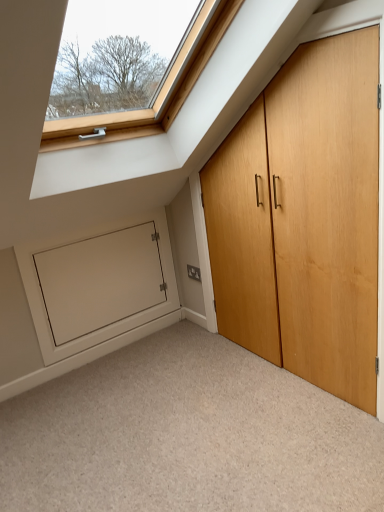
Question: Is white matte door at lower left far away from carpeted floor at lower center?

Choices:
 (A) yes
 (B) no

Answer: (B)

Question: From the image's perspective, would you say white matte door at lower left is shown under carpeted floor at lower center?

Choices:
 (A) yes
 (B) no

Answer: (B)

Question: Does white matte door at lower left have a greater height compared to carpeted floor at lower center?

Choices:
 (A) no
 (B) yes

Answer: (B)

Question: Considering the relative sizes of white matte door at lower left and carpeted floor at lower center in the image provided, is white matte door at lower left bigger than carpeted floor at lower center?

Choices:
 (A) no
 (B) yes

Answer: (A)

Question: Does white matte door at lower left appear on the right side of carpeted floor at lower center?

Choices:
 (A) no
 (B) yes

Answer: (A)

Question: Is carpeted floor at lower center taller or shorter than white matte door at lower left?

Choices:
 (A) tall
 (B) short

Answer: (B)

Question: From the image's perspective, is carpeted floor at lower center located above or below white matte door at lower left?

Choices:
 (A) above
 (B) below

Answer: (B)

Question: Visually, is carpeted floor at lower center positioned to the left or to the right of white matte door at lower left?

Choices:
 (A) right
 (B) left

Answer: (A)

Question: Do you think carpeted floor at lower center is within white matte door at lower left, or outside of it?

Choices:
 (A) inside
 (B) outside

Answer: (B)

Question: From the image's perspective, relative to white matte door at lower left, is light brown wood door at right above or below?

Choices:
 (A) above
 (B) below

Answer: (A)

Question: Considering the positions of light brown wood door at right and white matte door at lower left in the image, is light brown wood door at right bigger or smaller than white matte door at lower left?

Choices:
 (A) small
 (B) big

Answer: (B)

Question: From a real-world perspective, is light brown wood door at right physically located above or below white matte door at lower left?

Choices:
 (A) below
 (B) above

Answer: (B)

Question: Is point (225, 269) closer or farther from the camera than point (69, 257)?

Choices:
 (A) closer
 (B) farther

Answer: (B)

Question: Is point (61, 258) positioned closer to the camera than point (24, 464)?

Choices:
 (A) closer
 (B) farther

Answer: (B)

Question: Is white matte door at lower left to the left or to the right of carpeted floor at lower center in the image?

Choices:
 (A) right
 (B) left

Answer: (B)